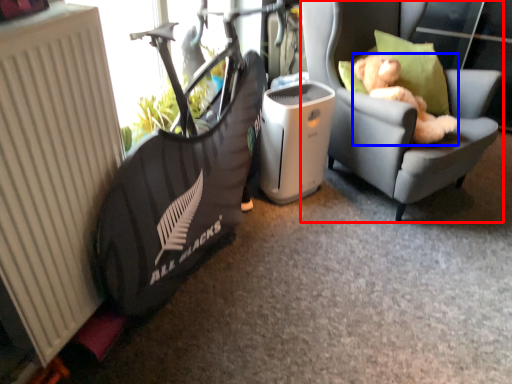
Question: Which point is further to the camera, chair (highlighted by a red box) or animal (highlighted by a blue box)?

Choices:
 (A) chair
 (B) animal

Answer: (B)